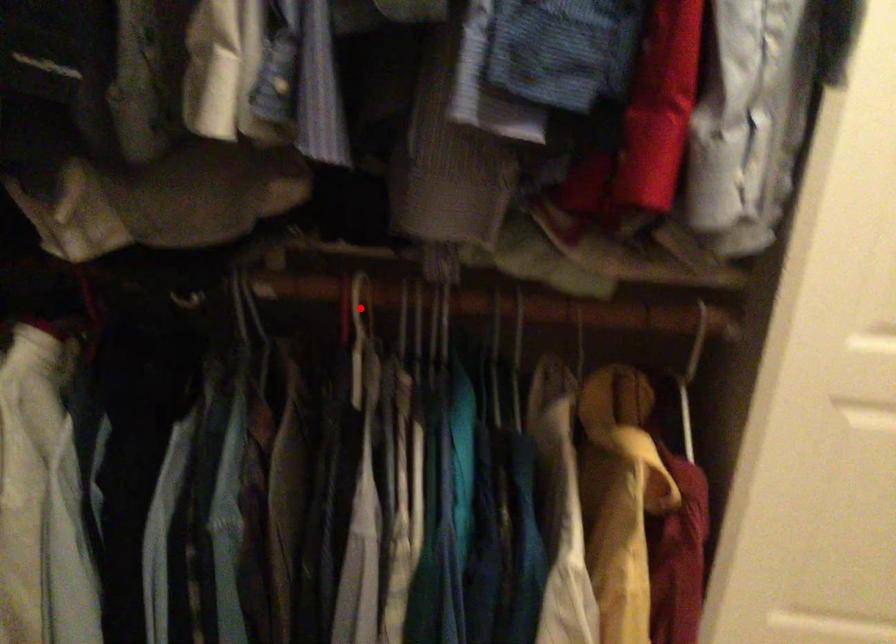
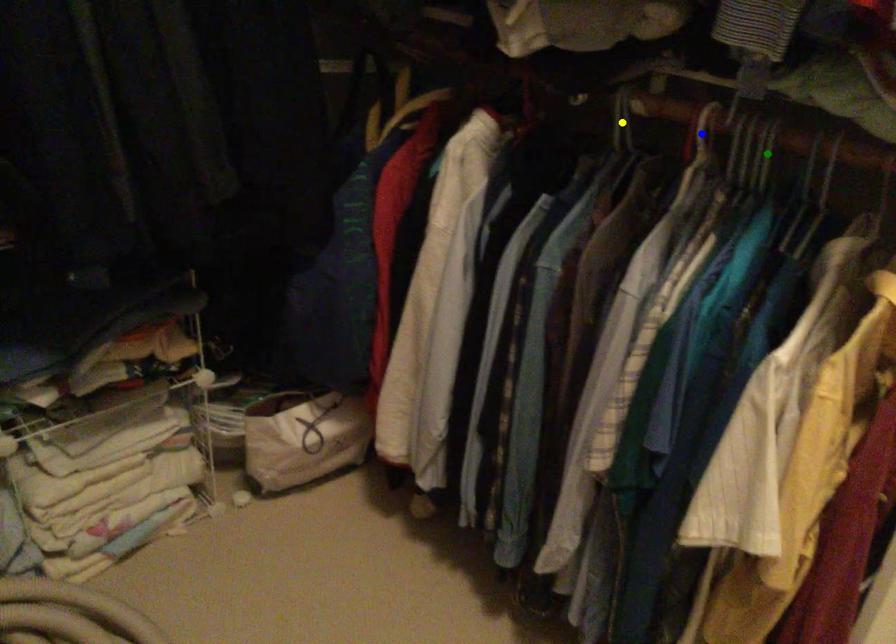
Question: I am providing you with two images of the same scene from different viewpoints. A red point is marked on the first image. You are given multiple points on the second image. In image 2, which mark is for the same physical point as the one in image 1?

Choices:
 (A) yellow point
 (B) green point
 (C) blue point

Answer: (C)